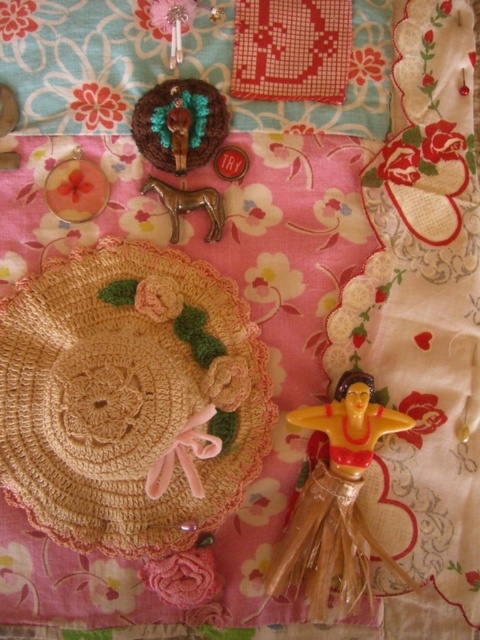
You are organizing a display of vintage items and need to place the yellow plastic barbie at lower right and the metallic gold horse at center on a shelf. Which item should you place first if you want to ensure the taller item is placed closer to the back of the shelf?

The yellow plastic barbie at lower right is much taller than the metallic gold horse at center. Therefore, you should place the yellow plastic barbie at lower right first to ensure the taller item is positioned closer to the back of the shelf.

You are organizing a vintage fair and need to arrange items on a shelf. You have the yellow plastic barbie at lower right and the turquoise felt brooch at upper center. Which item should you place higher on the shelf to match the arrangement in the image?

The turquoise felt brooch at upper center should be placed higher on the shelf since in the image it is positioned above the yellow plastic barbie at lower right.